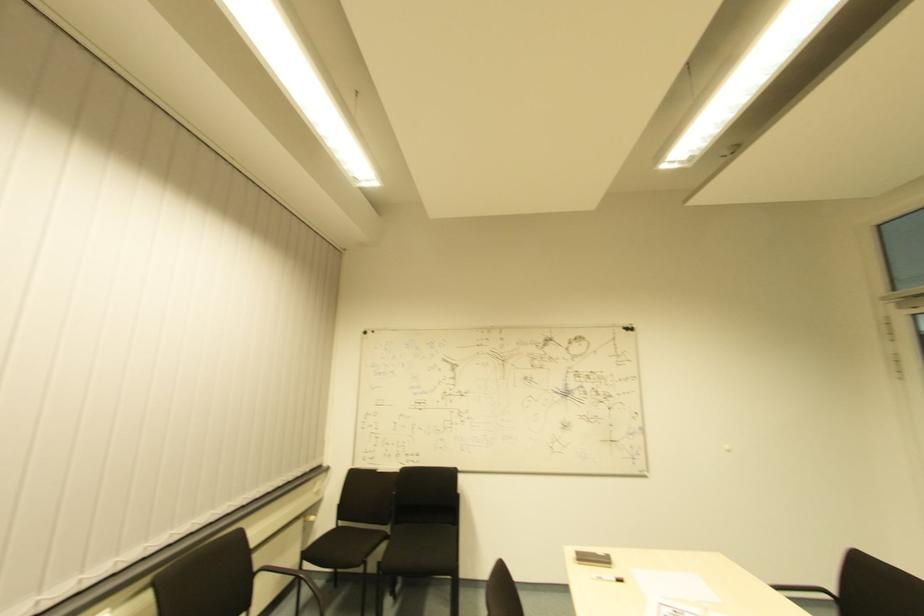
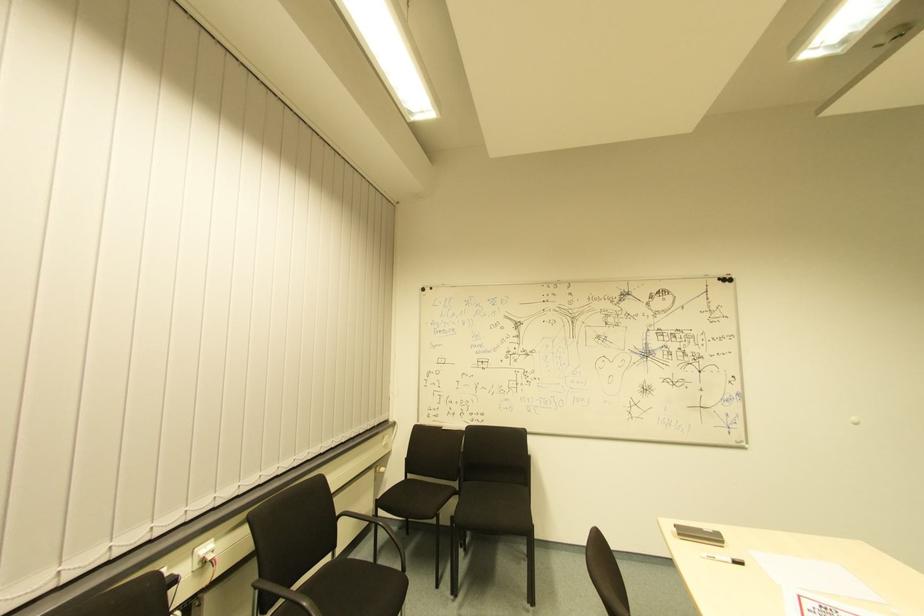
In the second image, find the point that corresponds to point (368, 334) in the first image.

(427, 293)